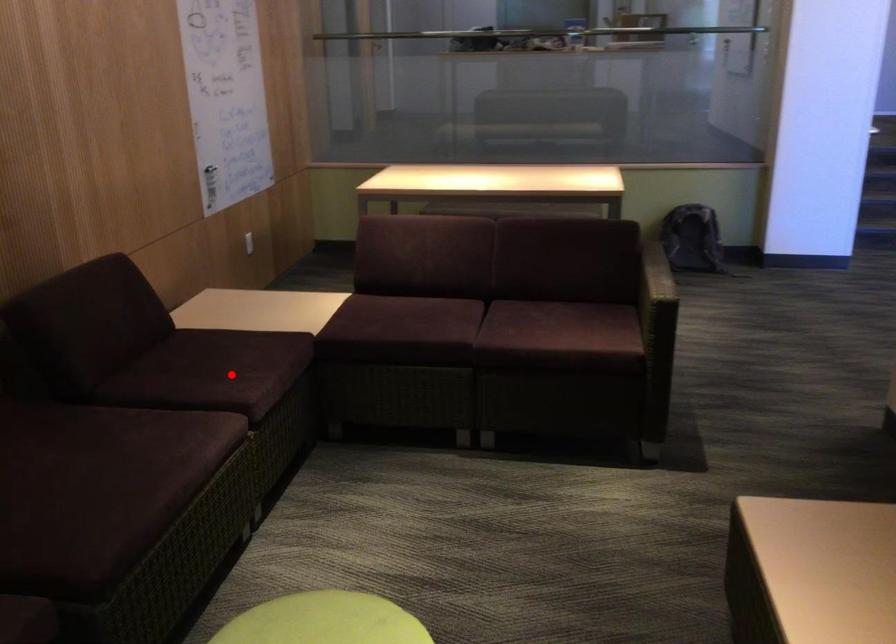
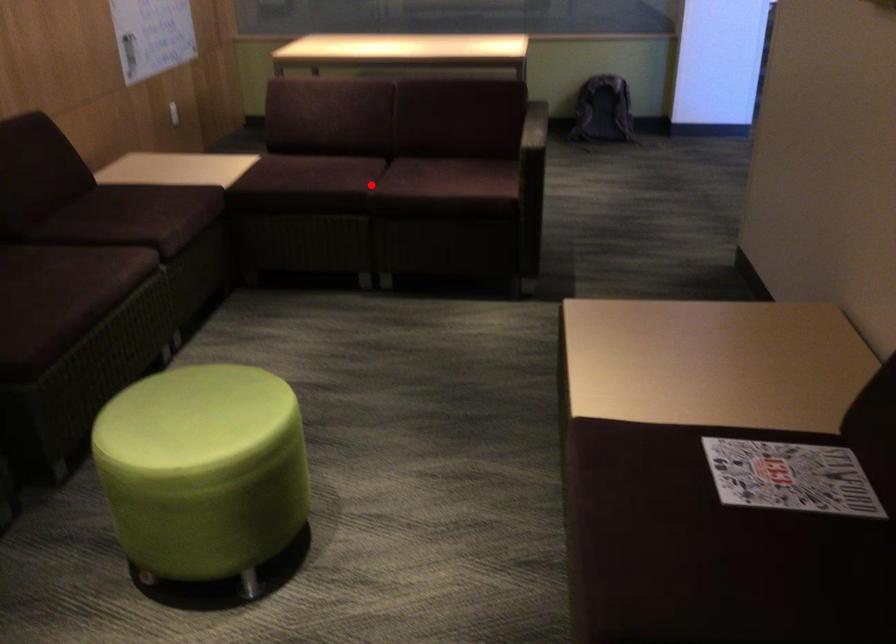
I am providing you with two images of the same scene from different viewpoints. A red point is marked on the first image and another point is marked on the second image. Do the highlighted points in image1 and image2 indicate the same real-world spot?

No